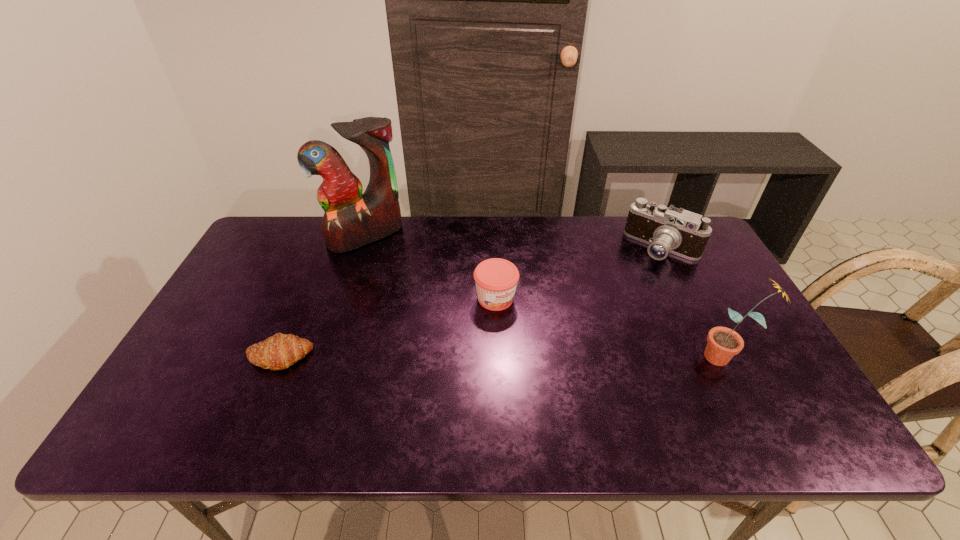
Find the location of a particular element. This screenshot has width=960, height=540. free space between the parrot and the third object from right to left is located at coordinates (431, 267).

This screenshot has height=540, width=960. Find the location of `object that is the fourth closest to the crescent roll`. object that is the fourth closest to the crescent roll is located at coordinates click(x=723, y=343).

Select which object appears as the third closest to the sunflower. Please provide its 2D coordinates. Your answer should be formatted as a tuple, i.e. [(x, y)], where the tuple contains the x and y coordinates of a point satisfying the conditions above.

[(351, 220)]

Locate an element on the screen. The image size is (960, 540). free space that satisfies the following two spatial constraints: 1. on the back side of the parrot; 2. on the left side of the shortest object is located at coordinates (330, 236).

Where is `free space that satisfies the following two spatial constraints: 1. on the back side of the shortest object; 2. on the flower of the sunflower`? This screenshot has width=960, height=540. free space that satisfies the following two spatial constraints: 1. on the back side of the shortest object; 2. on the flower of the sunflower is located at coordinates (279, 356).

Locate an element on the screen. free location that satisfies the following two spatial constraints: 1. on the front side of the third object from left to right; 2. on the flower of the sunflower is located at coordinates (498, 356).

You are a GUI agent. You are given a task and a screenshot of the screen. Output one action in this format:
    pyautogui.click(x=<x>, y=<y>)
    Task: Click on the free space that satisfies the following two spatial constraints: 1. on the front side of the third shortest object; 2. on the flower of the second tallest object
    The image size is (960, 540).
    Given the screenshot: What is the action you would take?
    pyautogui.click(x=716, y=356)

Locate an element on the screen. free space that satisfies the following two spatial constraints: 1. on the back side of the shortest object; 2. on the flower of the sunflower is located at coordinates (279, 356).